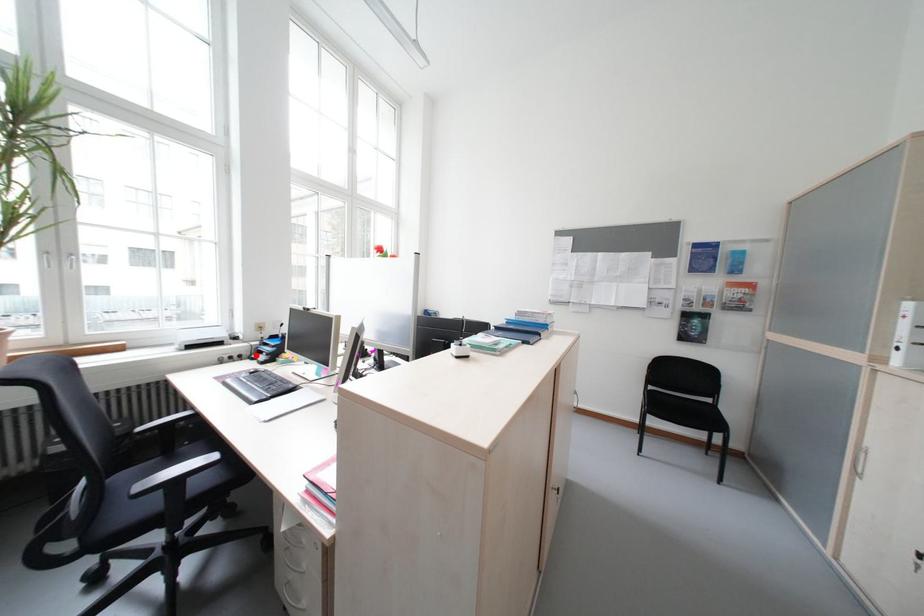
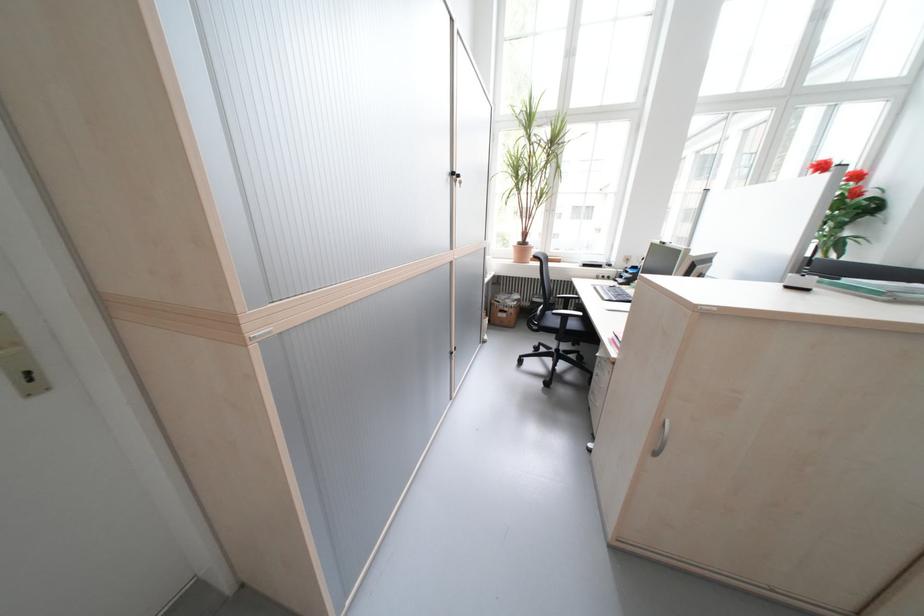
Where in the second image is the point corresponding to the highlighted location from the first image?

(623, 278)